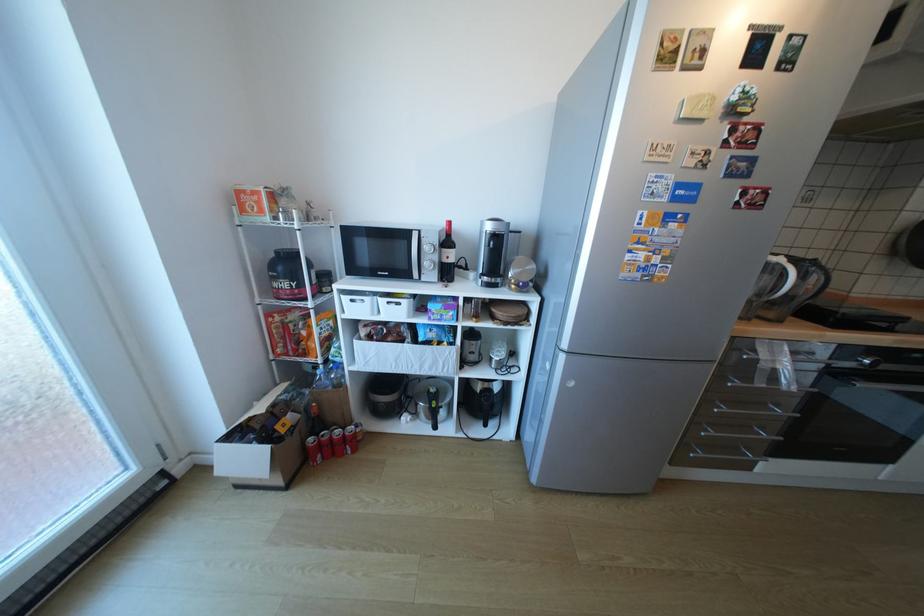
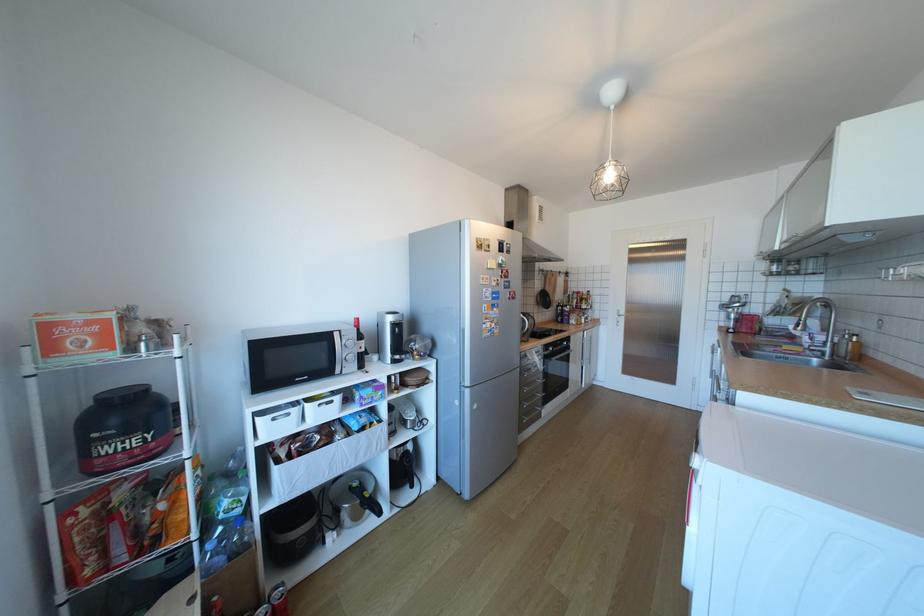
In the second image, find the point that corresponds to (299,285) in the first image.

(152, 439)